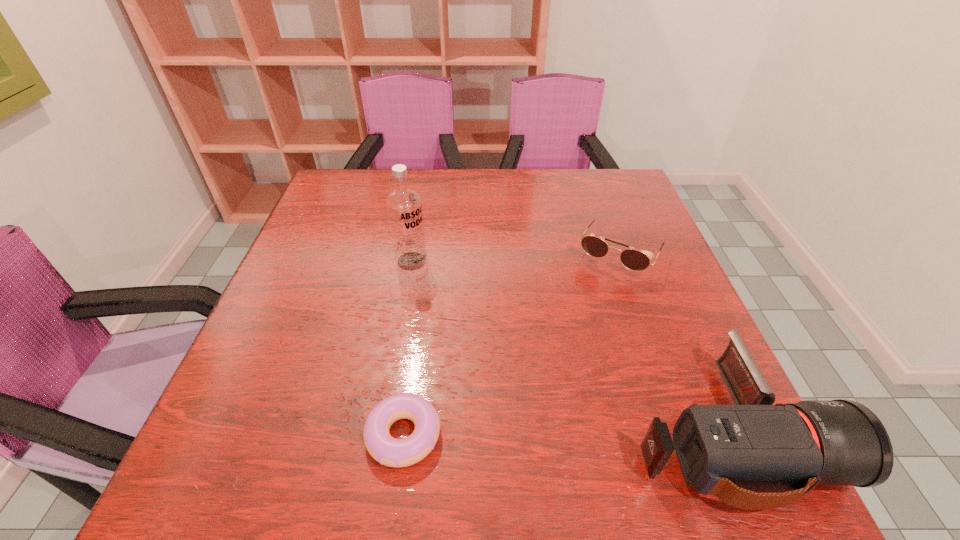
What are the coordinates of `vacant point located on the front lenses of the sunglasses` in the screenshot? It's located at (587, 309).

Identify the location of doughnut that is positioned at the near edge. (388, 451).

The height and width of the screenshot is (540, 960). I want to click on camcorder that is at the near edge, so click(729, 451).

I want to click on camcorder that is at the right edge, so click(729, 451).

This screenshot has width=960, height=540. In order to click on sunglasses present at the right edge in this screenshot , I will do `click(635, 260)`.

At what (x,y) coordinates should I click in order to perform the action: click on object located at the near right corner. Please return your answer as a coordinate pair (x, y). Image resolution: width=960 pixels, height=540 pixels. Looking at the image, I should click on (729, 451).

Image resolution: width=960 pixels, height=540 pixels. In the image, there is a desktop. In order to click on vacant space at the far edge in this screenshot , I will do `click(423, 171)`.

Where is `vacant space at the near edge`? Image resolution: width=960 pixels, height=540 pixels. vacant space at the near edge is located at coordinates (396, 422).

You are a GUI agent. You are given a task and a screenshot of the screen. Output one action in this format:
    pyautogui.click(x=<x>, y=<y>)
    Task: Click on the free region at the left edge
    The image size is (960, 540).
    Given the screenshot: What is the action you would take?
    pyautogui.click(x=287, y=321)

The width and height of the screenshot is (960, 540). In the image, there is a desktop. Identify the location of vacant space at the right edge. (659, 358).